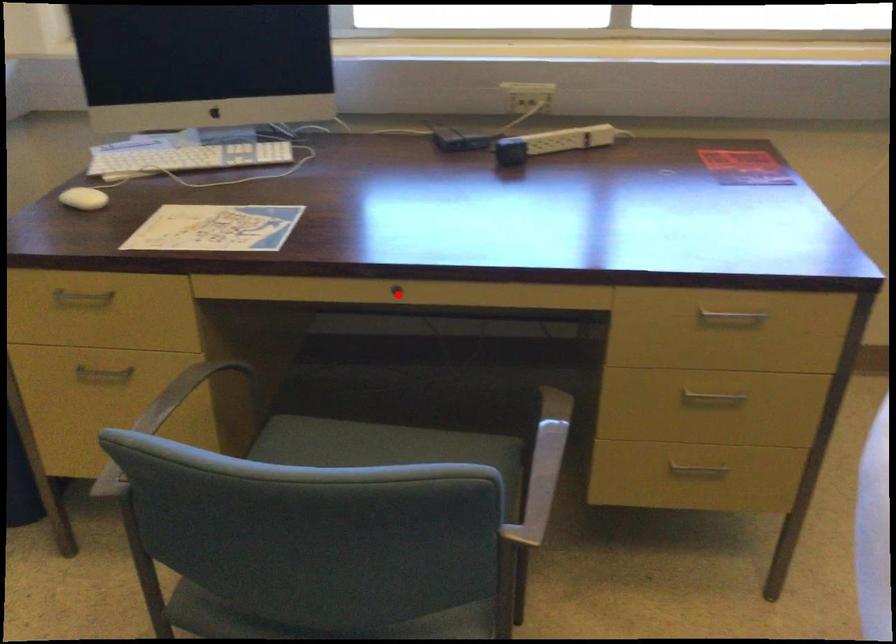
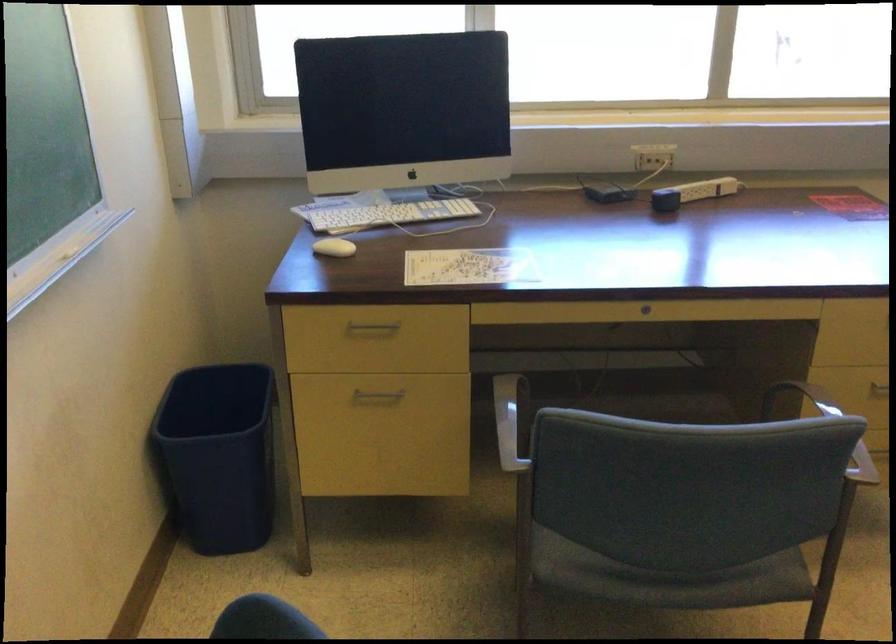
Question: I am providing you with two images of the same scene from different viewpoints. Image1 has a red point marked. In image2, the corresponding 3D location appears at what relative position? Reply with the corresponding letter.

Choices:
 (A) Closer
 (B) Farther

Answer: (B)